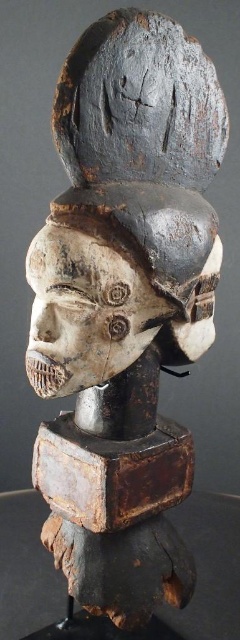
Based on the scene description, which object is wider? The white carved wood mask at center or the dark gray wood mask at upper center?

The white carved wood mask at center is wider than the dark gray wood mask at upper center according to the description.

You are an art curator arranging an exhibition. You have two masks displayed in the gallery. The white carved wood mask at center and the dark gray wood mask at upper center. From the visitor entrance, which mask will appear closer to the viewer?

The white carved wood mask at center will appear closer to the viewer because the dark gray wood mask at upper center is positioned behind it.

You are an art conservator examining the wooden sculpture. You notice a specific point at coordinates (120, 284). What object does this point correspond to?

The point at coordinates (120, 284) corresponds to the white carved wood mask at center.